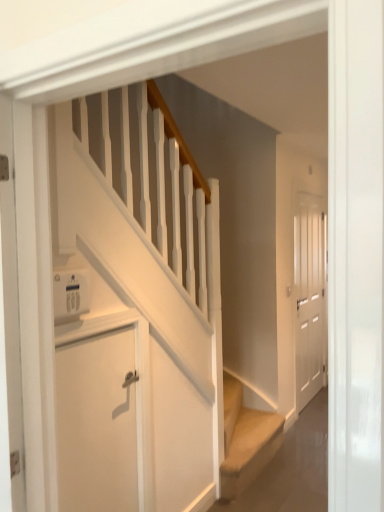
Question: Considering the positions of white matte door at lower left, which appears as the first door when viewed from the left, and white matte door at right, arranged as the 2th door when viewed from the front, in the image, is white matte door at lower left, which appears as the first door when viewed from the left, wider or thinner than white matte door at right, arranged as the 2th door when viewed from the front,?

Choices:
 (A) thin
 (B) wide

Answer: (A)

Question: From a real-world perspective, is white matte door at lower left, which appears as the 1th door when viewed from the front, physically located above or below white matte door at right, the 1th door viewed from the back?

Choices:
 (A) above
 (B) below

Answer: (B)

Question: Considering the real-world distances, which object is farthest from the white matte door at lower left, the second door positioned from the back?

Choices:
 (A) white plastic thermostat at upper left
 (B) white matte door at right, the 1th door viewed from the back

Answer: (B)

Question: Estimate the real-world distances between objects in this image. Which object is farther from the white matte door at right, which appears as the 1th door when viewed from the right?

Choices:
 (A) white plastic thermostat at upper left
 (B) white matte door at lower left, which ranks as the second door in right-to-left order

Answer: (A)